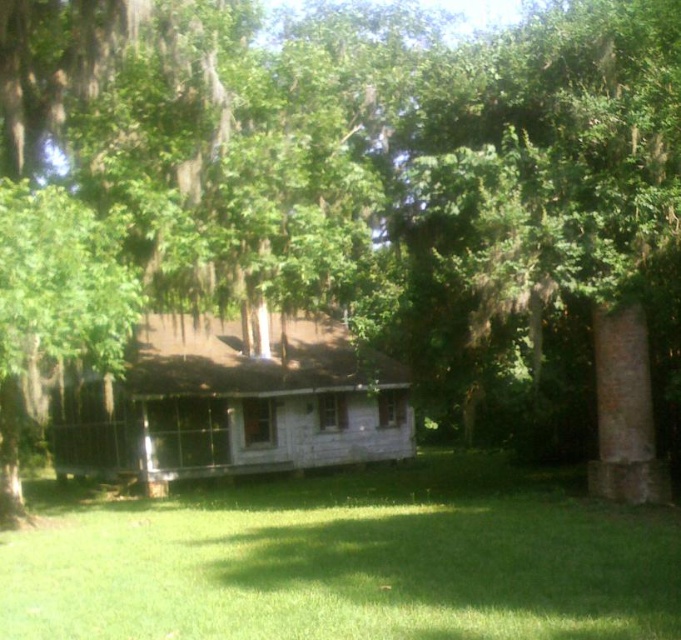
You are standing in front of the house and want to walk towards the green grass at lower center. Which direction should you move relative to the weathered wood porch at center?

The green grass at lower center is to the right of the weathered wood porch at center, so you should move to the right of the weathered wood porch at center to reach it.

You are standing in front of the house and want to walk from the green grass at lower center to the weathered wood porch at center. Can you step directly from the grass to the porch without needing to move sideways?

The green grass at lower center is wider than the weathered wood porch at center, so stepping directly might require adjusting your position since the porch is narrower. You may need to move sideways slightly to align with the porch.